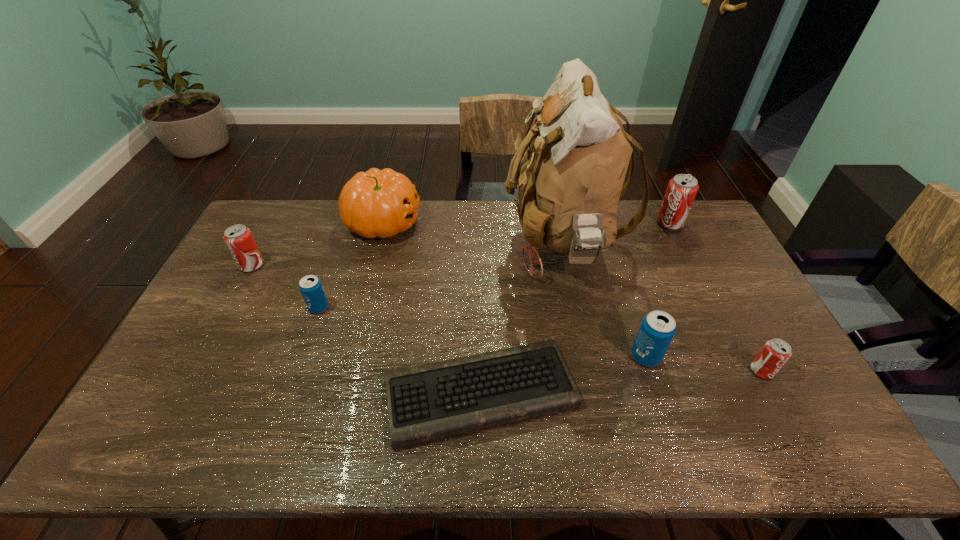
Identify the location of empty space that is in between the shortest object and the backpack. The height and width of the screenshot is (540, 960). (521, 319).

Choose which object is the second nearest neighbor to the smallest pink soda can. Please provide its 2D coordinates. Your answer should be formatted as a tuple, i.e. [(x, y)], where the tuple contains the x and y coordinates of a point satisfying the conditions above.

[(570, 181)]

Select which object appears as the closest to the right blue soda can. Please provide its 2D coordinates. Your answer should be formatted as a tuple, i.e. [(x, y)], where the tuple contains the x and y coordinates of a point satisfying the conditions above.

[(435, 401)]

Identify which soda can is the second closest to the farthest soda can. Please provide its 2D coordinates. Your answer should be formatted as a tuple, i.e. [(x, y)], where the tuple contains the x and y coordinates of a point satisfying the conditions above.

[(775, 353)]

This screenshot has width=960, height=540. I want to click on soda can that stands as the third closest to the smaller blue soda can, so click(681, 191).

At what (x,y) coordinates should I click in order to perform the action: click on the second closest pink soda can relative to the nearest pink soda can. Please return your answer as a coordinate pair (x, y). Looking at the image, I should click on (238, 238).

At what (x,y) coordinates should I click in order to perform the action: click on the closest pink soda can relative to the pumpkin. Please return your answer as a coordinate pair (x, y). Looking at the image, I should click on (238, 238).

Identify the location of vacant space that satisfies the following two spatial constraints: 1. on the carved face of the pumpkin; 2. on the left side of the bigger blue soda can. (349, 356).

This screenshot has width=960, height=540. Find the location of `vacant space that satisfies the following two spatial constraints: 1. on the front side of the biggest pink soda can; 2. on the front-facing side of the tallest object`. vacant space that satisfies the following two spatial constraints: 1. on the front side of the biggest pink soda can; 2. on the front-facing side of the tallest object is located at coordinates (681, 245).

Find the location of `free spot that satisfies the following two spatial constraints: 1. on the carved face of the orange pumpkin; 2. on the right side of the third soda can from left to right`. free spot that satisfies the following two spatial constraints: 1. on the carved face of the orange pumpkin; 2. on the right side of the third soda can from left to right is located at coordinates (349, 356).